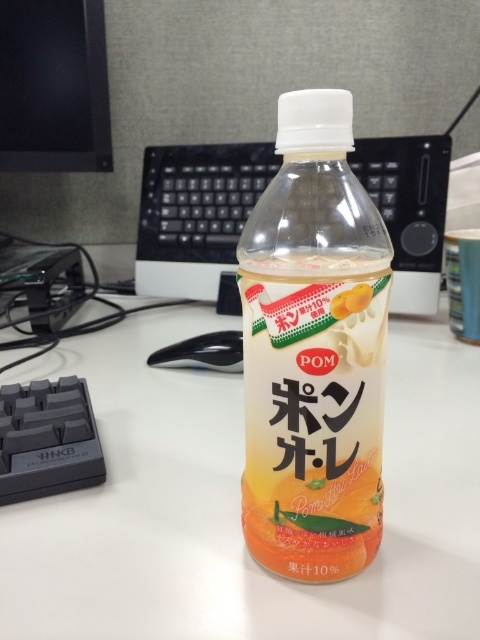
You are standing at the edge of the desk and want to place a small sticker exactly at the center of the desk. The coordinates given are in a system where the bottom left corner is the origin. Can you confirm if the point at point (239, 502) is the center of the desk?

The point at (239, 502) is the center of the desk according to the provided coordinates, so yes, placing the sticker there would mark the center.

You are standing at point 0.5, 0.5 in the image. You want to move to the white plastic table at center. Which direction should you move?

Since the white plastic table at center is located at point (239, 502), you should move to the right to reach it.